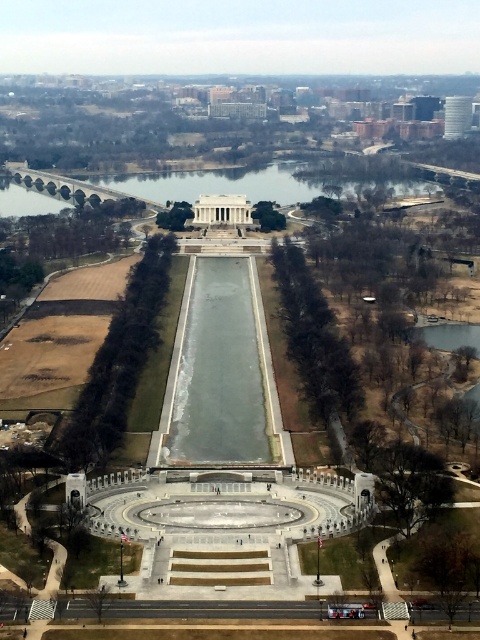
Can you confirm if clear glass water at center is thinner than white marble palace at center?

In fact, clear glass water at center might be wider than white marble palace at center.

Is point (393, 188) positioned after point (206, 225)?

Yes.

The image size is (480, 640). I want to click on clear glass water at center, so click(x=253, y=182).

Is clear glass waterway at center positioned in front of clear glass water at center?

Yes, clear glass waterway at center is closer to the viewer.

What do you see at coordinates (218, 371) in the screenshot? I see `clear glass waterway at center` at bounding box center [218, 371].

Where is `clear glass waterway at center`? This screenshot has width=480, height=640. clear glass waterway at center is located at coordinates (218, 371).

Is clear glass waterway at center thinner than white marble palace at center?

Correct, clear glass waterway at center's width is less than white marble palace at center's.

Which is behind, point (203, 380) or point (199, 212)?

Positioned behind is point (199, 212).

Which is behind, point (233, 412) or point (219, 218)?

Positioned behind is point (219, 218).

Find the location of `clear glass waterway at center`. clear glass waterway at center is located at coordinates (218, 371).